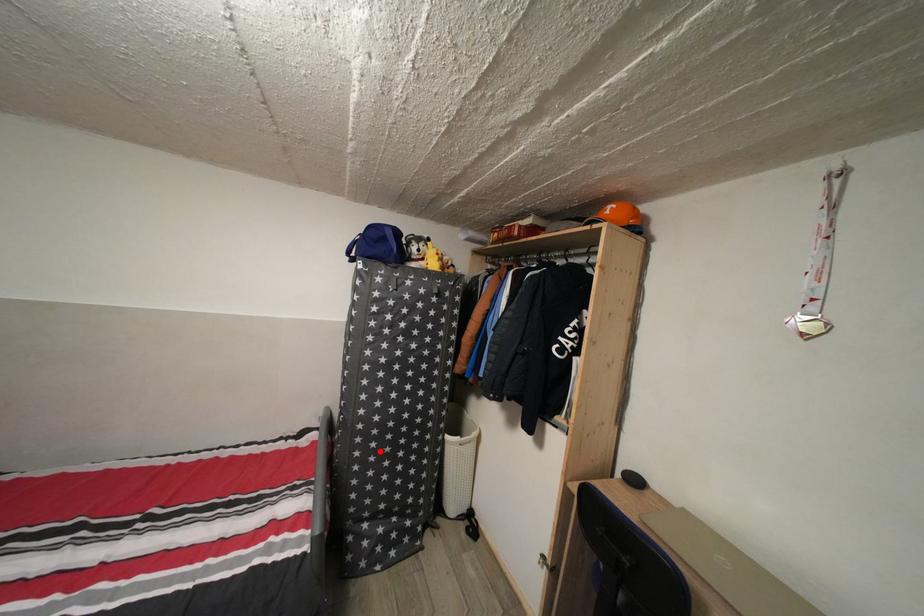
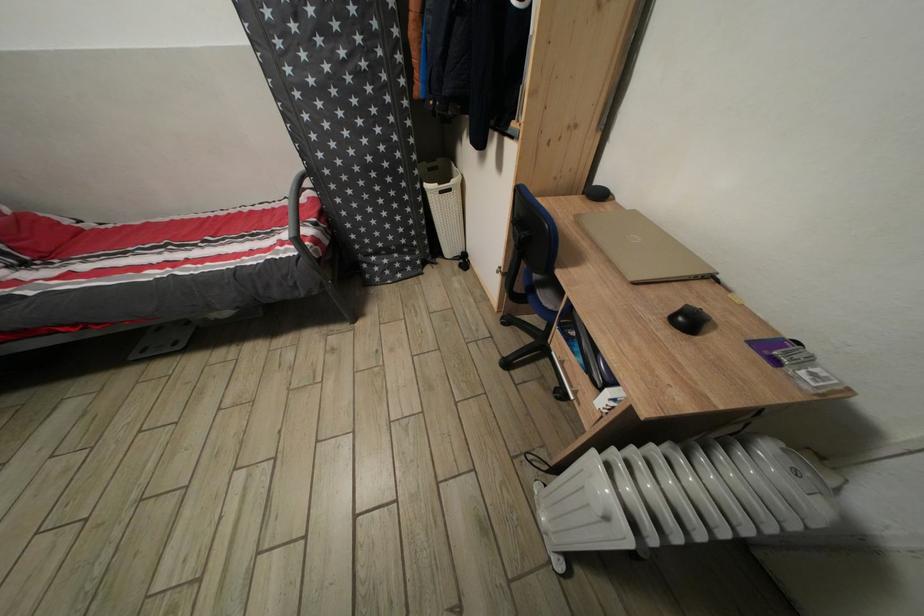
Question: I am providing you with two images of the same scene from different viewpoints. Image1 has a red point marked. In image2, the corresponding 3D location appears at what relative position? Reply with the corresponding letter.

Choices:
 (A) Closer
 (B) Farther

Answer: (A)